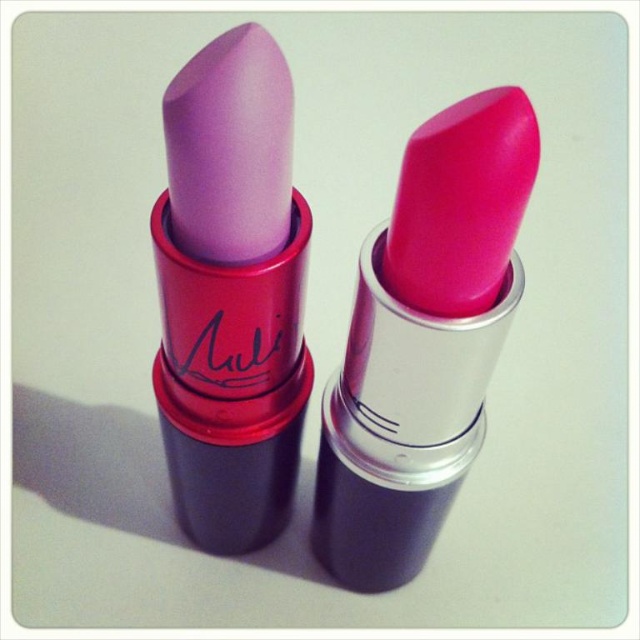
You are a makeup artist who needs to reach for the matte pink lipstick at center. If your hand can extend 60 centimeters, will you be able to reach it without moving your body?

The matte pink lipstick at center is 58.24 centimeters away from the viewer, so yes, the makeup artist can reach it with their hand extended 60 centimeters since it is within reach.

You are a beauty blogger who wants to film a review of these lipsticks. Your camera can only capture objects within a 6 inch frame. If you position the camera to focus on the matte purple lipstick at left, will the matte pink lipstick at center also be fully visible in the frame?

The distance between the matte pink lipstick at center and the matte purple lipstick at left is 6.32 inches. Since the camera frame is only 6 inches wide, the matte pink lipstick at center will not be fully visible within the frame when focusing on the matte purple lipstick at left.

You are an assistant organizing a makeup counter. You need to place a new lipstick sample at the point labeled as point (422, 340). Which lipstick at the center is this point located on?

The point (422, 340) is on the matte pink lipstick at center.